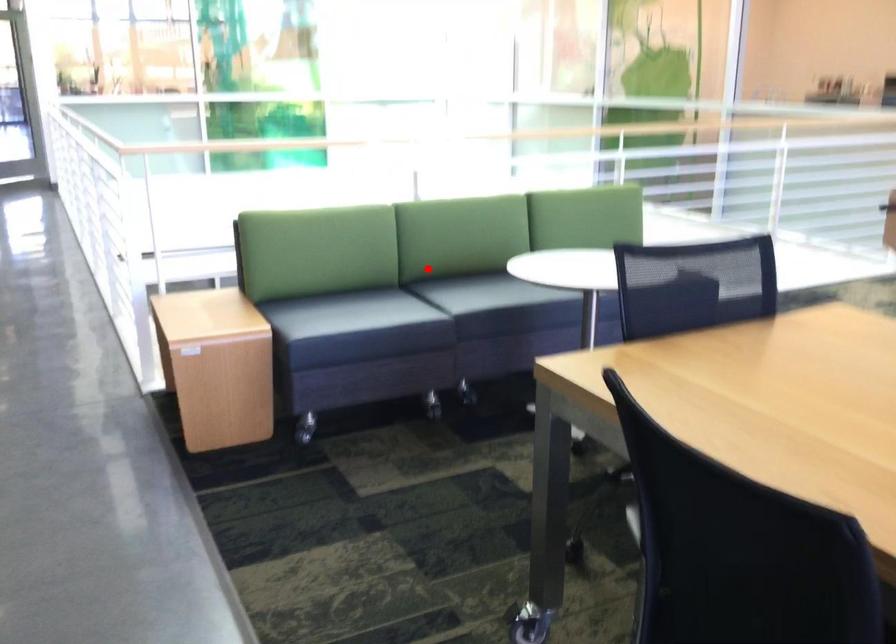
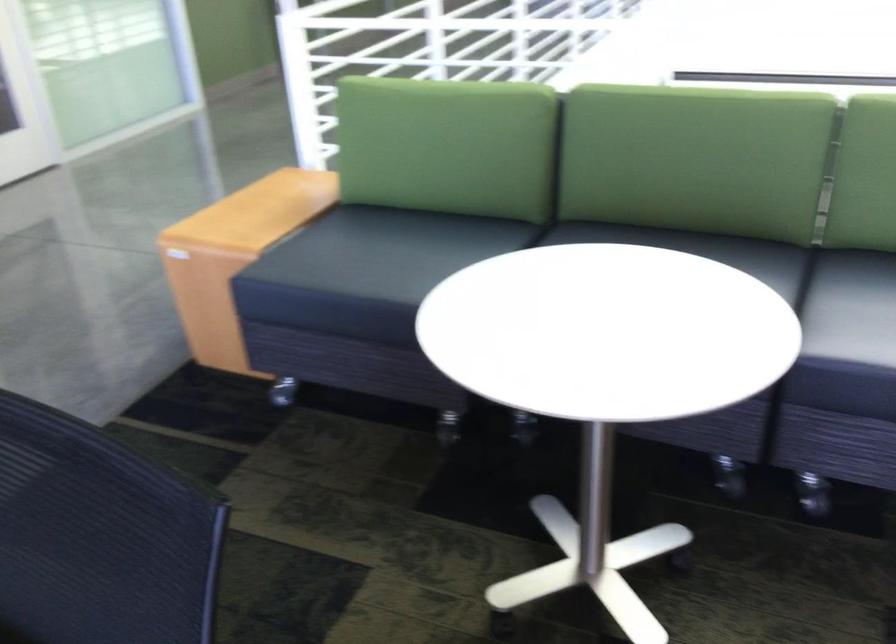
Question: A red point is marked in image1. In image2, is the corresponding 3D point closer to the camera or farther? Reply with the corresponding letter.

Choices:
 (A) The corresponding 3D point is closer.
 (B) The corresponding 3D point is farther.

Answer: (A)